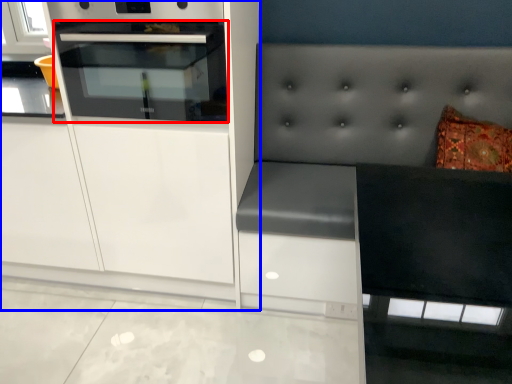
Question: Which object is further to the camera taking this photo, oven (highlighted by a red box) or cabinetry (highlighted by a blue box)?

Choices:
 (A) oven
 (B) cabinetry

Answer: (B)